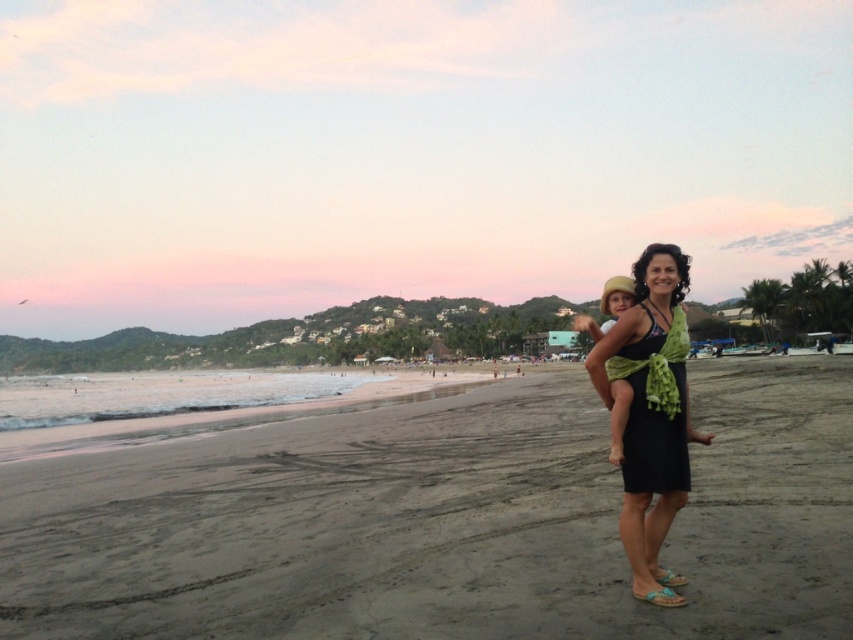
You are a photographer wanting to capture the dark brown sand at center and the black fabric dress at center in the same frame. Which object will appear bigger in your photo?

The dark brown sand at center will appear bigger in the photo because it has a larger size compared to the black fabric dress at center.

You are a photographer planning to take a photo of the beach scene. You notice the dark brown sand at center and the black satin dress at center. Which object should you focus on first if you want to capture the foreground elements before the background?

The dark brown sand at center is below the black satin dress at center, so you should focus on the dark brown sand at center first as it is closer to the foreground.

You are a photographer wanting to capture the black satin dress at center and the dark brown sand at center in the same frame. Which object should you focus on first if you want to ensure both are in focus?

The dark brown sand at center is in front of the black satin dress at center, so you should focus on the dark brown sand at center first to ensure both are in focus.